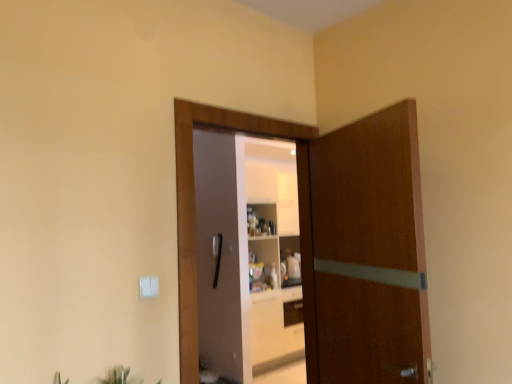
Question: Is green leafy plant at lower center outside brown wooden door at center, which is the 1th door from right to left?

Choices:
 (A) yes
 (B) no

Answer: (A)

Question: Does green leafy plant at lower center have a smaller size compared to brown wooden door at center, the second door when ordered from left to right?

Choices:
 (A) no
 (B) yes

Answer: (B)

Question: From a real-world perspective, is green leafy plant at lower center physically below brown wooden door at center, the second door when ordered from left to right?

Choices:
 (A) no
 (B) yes

Answer: (B)

Question: Are green leafy plant at lower center and brown wooden door at center, the second door when ordered from left to right, beside each other?

Choices:
 (A) no
 (B) yes

Answer: (A)

Question: Is green leafy plant at lower center taller than brown wooden door at center, which is the 1th door from right to left?

Choices:
 (A) yes
 (B) no

Answer: (B)

Question: Is brown wooden door at center, which is the 1th door from right to left, taller or shorter than green leafy plant at lower center?

Choices:
 (A) short
 (B) tall

Answer: (B)

Question: From a real-world perspective, relative to green leafy plant at lower center, is brown wooden door at center, the second door when ordered from left to right, vertically above or below?

Choices:
 (A) above
 (B) below

Answer: (A)

Question: From the image's perspective, is brown wooden door at center, the second door when ordered from left to right, above or below green leafy plant at lower center?

Choices:
 (A) below
 (B) above

Answer: (B)

Question: Considering the positions of brown wooden door at center, the second door when ordered from left to right, and green leafy plant at lower center in the image, is brown wooden door at center, the second door when ordered from left to right, wider or thinner than green leafy plant at lower center?

Choices:
 (A) thin
 (B) wide

Answer: (A)

Question: Which is correct: brown wooden door at center, the second door when ordered from left to right, is inside wooden door at center, the 1th door in the left-to-right sequence, or outside of it?

Choices:
 (A) outside
 (B) inside

Answer: (A)

Question: Considering the positions of brown wooden door at center, which is the 1th door from right to left, and wooden door at center, the 1th door in the left-to-right sequence, in the image, is brown wooden door at center, which is the 1th door from right to left, wider or thinner than wooden door at center, the 1th door in the left-to-right sequence,?

Choices:
 (A) wide
 (B) thin

Answer: (A)

Question: From the image's perspective, is brown wooden door at center, the second door when ordered from left to right, located above or below wooden door at center, the 1th door in the left-to-right sequence?

Choices:
 (A) below
 (B) above

Answer: (A)

Question: Relative to wooden door at center, the second door when ordered from right to left, is brown wooden door at center, the second door when ordered from left to right, in front or behind?

Choices:
 (A) front
 (B) behind

Answer: (A)

Question: Considering the positions of green leafy plant at lower center and brown wooden door at center, which is the 1th door from right to left, in the image, is green leafy plant at lower center taller or shorter than brown wooden door at center, which is the 1th door from right to left,?

Choices:
 (A) tall
 (B) short

Answer: (B)

Question: In terms of width, does green leafy plant at lower center look wider or thinner when compared to brown wooden door at center, which is the 1th door from right to left?

Choices:
 (A) wide
 (B) thin

Answer: (A)